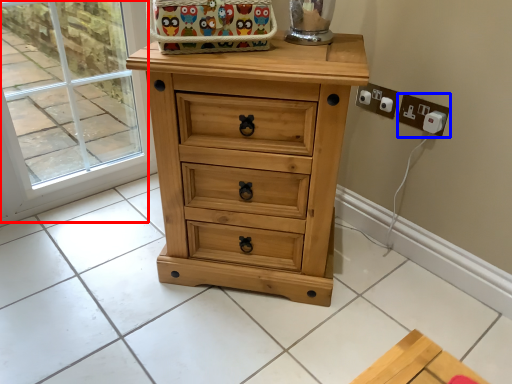
Question: Which of the following is the farthest to the observer, glass door (highlighted by a red box) or electric outlet (highlighted by a blue box)?

Choices:
 (A) glass door
 (B) electric outlet

Answer: (B)